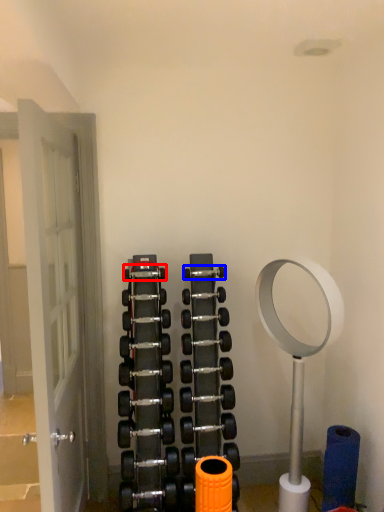
Question: Which object is further to the camera taking this photo, dumbbell (highlighted by a red box) or dumbbell (highlighted by a blue box)?

Choices:
 (A) dumbbell
 (B) dumbbell

Answer: (B)